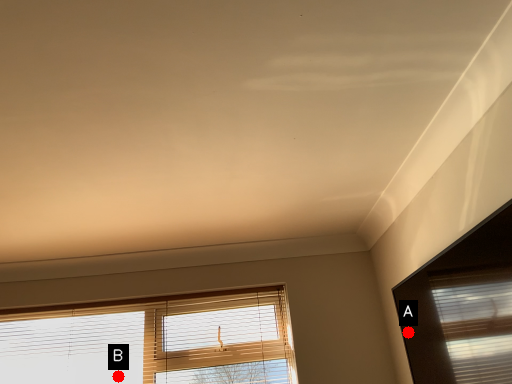
Question: Two points are circled on the image, labeled by A and B beside each circle. Which point is closer to the camera?

Choices:
 (A) A is closer
 (B) B is closer

Answer: (A)